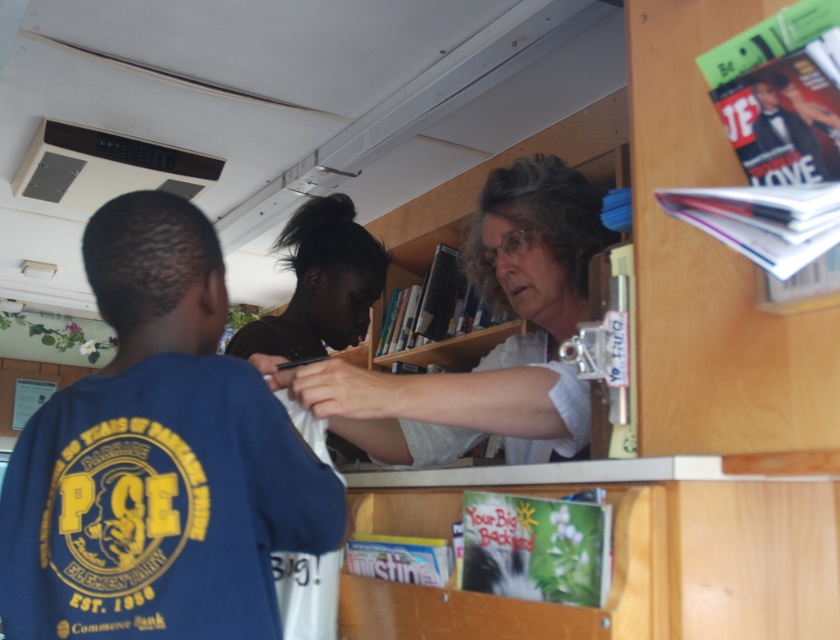
Question: Which of these objects is positioned closest to the white textured shirt at center?

Choices:
 (A) matte paper magazine at upper right
 (B) blue cotton shirt at center
 (C) shiny plastic magazine at upper right
 (D) blue glossy magazine at lower center

Answer: (B)

Question: Which object is positioned farthest from the blue glossy magazine at lower center?

Choices:
 (A) matte black book at upper center
 (B) green matte book at lower center
 (C) blue cotton shirt at center

Answer: (A)

Question: Does green matte book at lower center lie in front of shiny plastic magazine at upper right?

Choices:
 (A) yes
 (B) no

Answer: (B)

Question: Among these objects, which one is farthest from the camera?

Choices:
 (A) blue cotton shirt at center
 (B) matte black book at upper center

Answer: (B)

Question: Can you confirm if white textured shirt at center is positioned to the left of matte paper magazine at upper right?

Choices:
 (A) no
 (B) yes

Answer: (B)

Question: Is white textured shirt at center to the right of green matte book at lower center from the viewer's perspective?

Choices:
 (A) no
 (B) yes

Answer: (A)